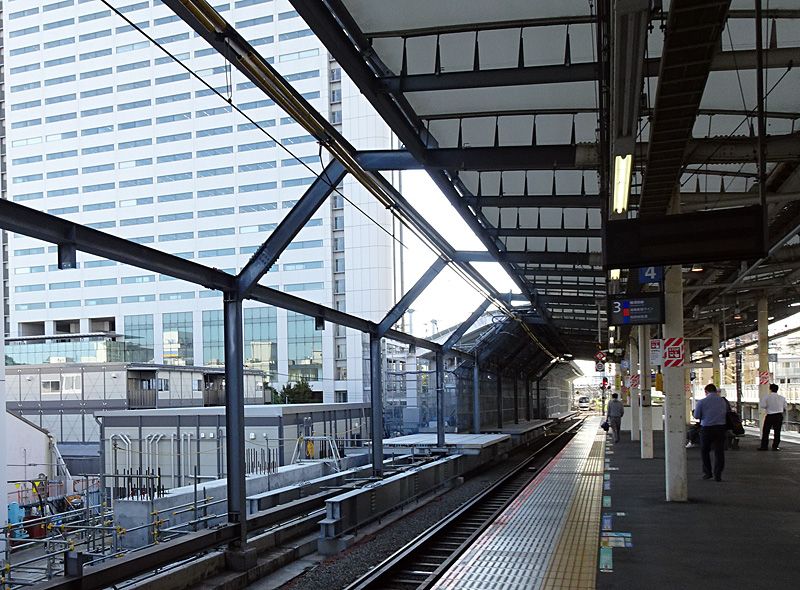
This screenshot has width=800, height=590. I want to click on ceiling, so click(x=532, y=103).